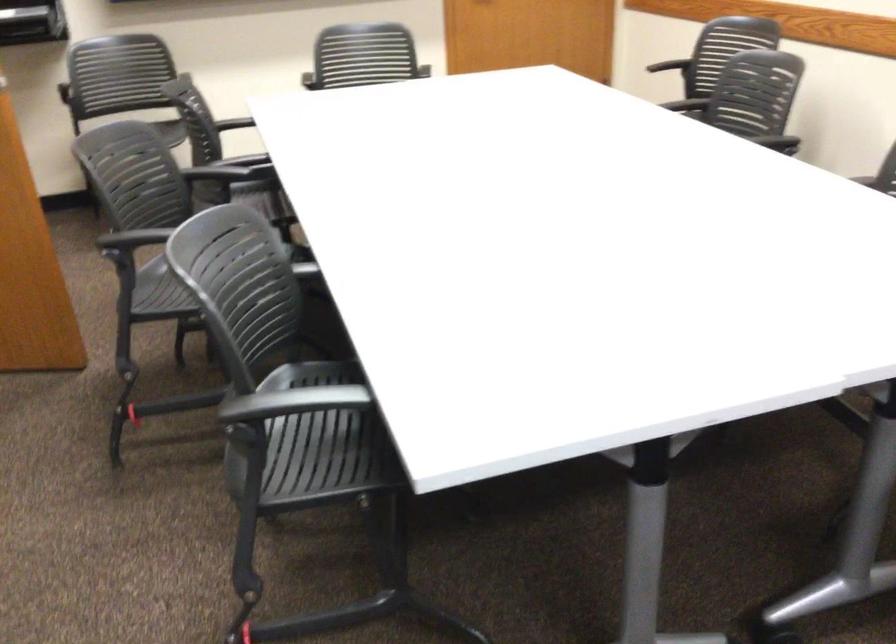
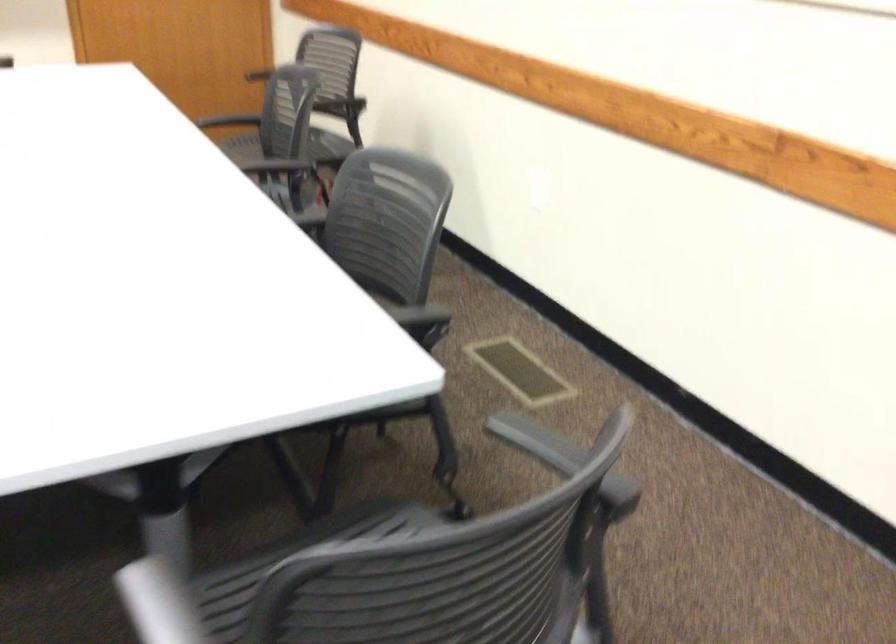
Question: The camera is either moving clockwise (left) or counter-clockwise (right) around the object. The first image is from the beginning of the video and the second image is from the end. Is the camera moving left or right when shooting the video?

Choices:
 (A) Left
 (B) Right

Answer: (A)